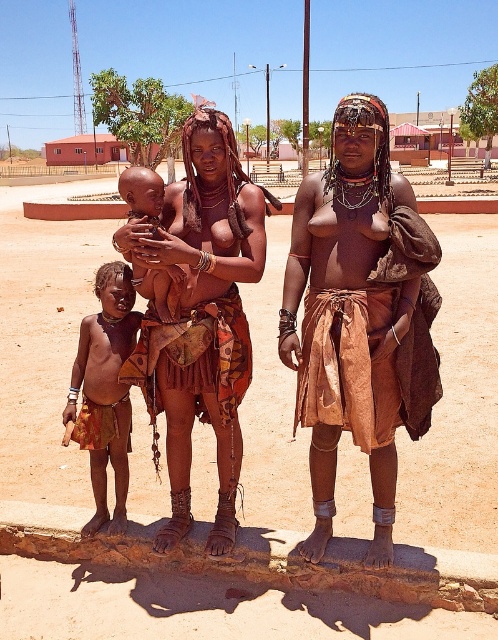
You are a photographer trying to capture a closeup shot of the brown leather skirt at center and the dark skin baby at center. Since you want both subjects to be clearly visible in the frame, which one should you focus on to ensure it takes up more space in your photo?

The dark skin baby at center occupies more space than the brown leather skirt at center, so focusing on it will ensure it takes up more space in the photo.